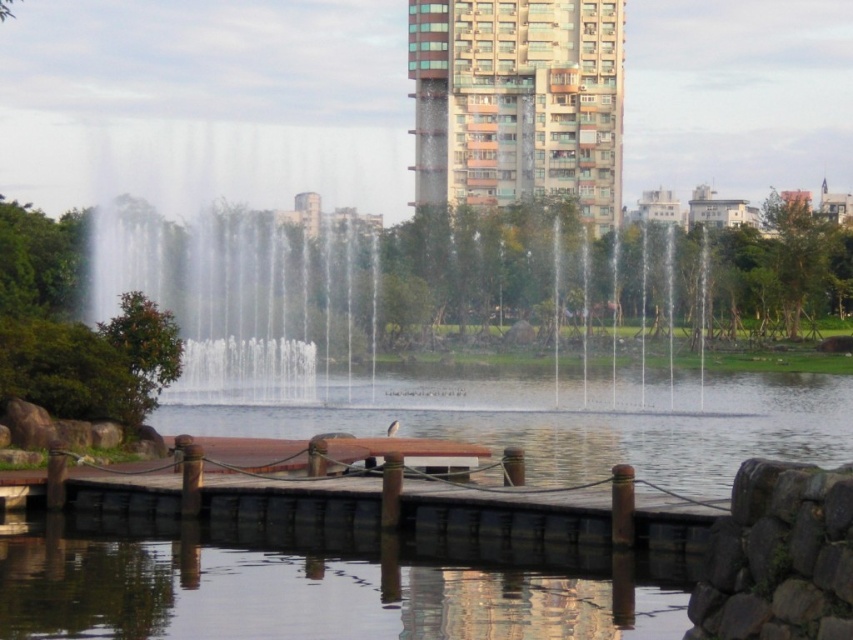
Who is more distant from viewer, (254,378) or (427,109)?

Positioned behind is point (427,109).

Image resolution: width=853 pixels, height=640 pixels. What do you see at coordinates (544, 419) in the screenshot?
I see `transparent water at dock center` at bounding box center [544, 419].

What do you see at coordinates (544, 419) in the screenshot? I see `transparent water at dock center` at bounding box center [544, 419].

Where is `transparent water at dock center`? transparent water at dock center is located at coordinates (544, 419).

Is transparent glass pond at center taller than brown glassy building at upper center?

No, transparent glass pond at center is not taller than brown glassy building at upper center.

Describe the element at coordinates (297, 593) in the screenshot. The height and width of the screenshot is (640, 853). I see `transparent glass pond at center` at that location.

Where is `transparent glass pond at center`? transparent glass pond at center is located at coordinates (297, 593).

Is white water at center in front of brown wooden picnic table at center?

No, it is behind brown wooden picnic table at center.

Does white water at center have a greater height compared to brown wooden picnic table at center?

Indeed, white water at center has a greater height compared to brown wooden picnic table at center.

Is point (316, 156) positioned in front of point (450, 454)?

No, (316, 156) is behind (450, 454).

Locate an element on the screen. white water at center is located at coordinates pyautogui.click(x=231, y=164).